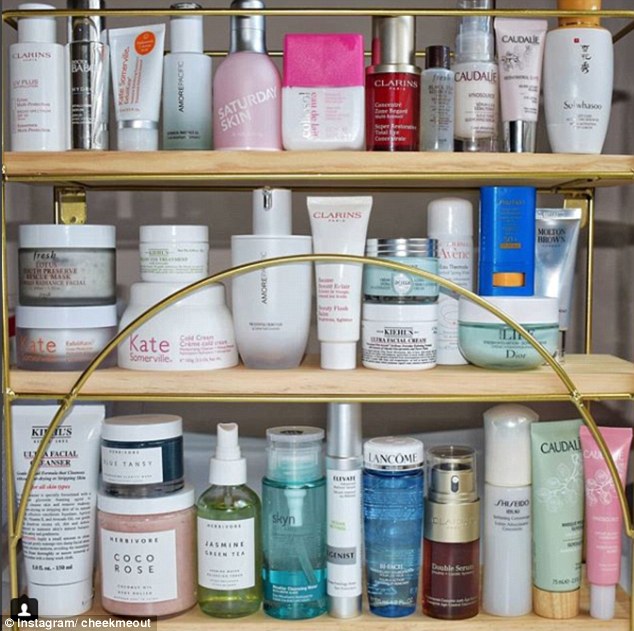
What are the coordinates of `bottom shelf, clear pump bottle with green liquid and white top` in the screenshot? It's located at (230, 603), (226, 505), (224, 463).